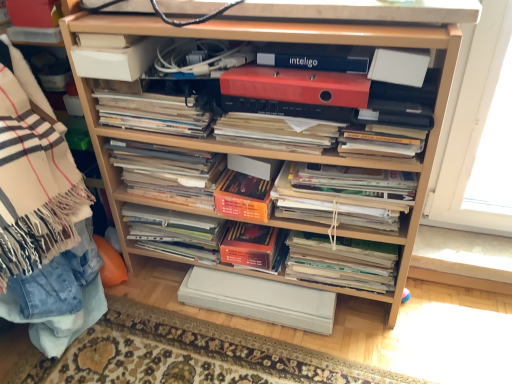
The width and height of the screenshot is (512, 384). Find the location of `vacant space that is in between wooden shelf at center and matte orange paperback book at center, which appears as the seventh paperback book when viewed from the top`. vacant space that is in between wooden shelf at center and matte orange paperback book at center, which appears as the seventh paperback book when viewed from the top is located at coordinates (343, 339).